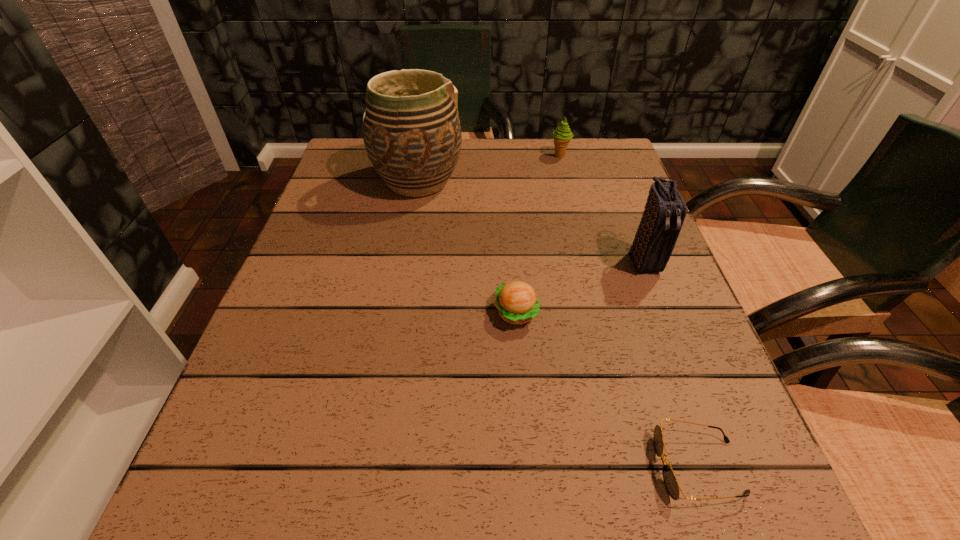
Locate an element on the screen. The image size is (960, 540). clutch bag that is at the right edge is located at coordinates (665, 210).

Identify the location of icecream at the right edge. The image size is (960, 540). (562, 135).

Locate an element on the screen. sunglasses located at the right edge is located at coordinates (670, 481).

Find the location of `object present at the far left corner`. object present at the far left corner is located at coordinates (411, 129).

Identify the location of object that is at the far right corner. The height and width of the screenshot is (540, 960). (562, 135).

This screenshot has width=960, height=540. Identify the location of object located at the near right corner. pyautogui.click(x=670, y=481).

At what (x,y) coordinates should I click in order to perform the action: click on free location at the far edge of the desktop. Please return your answer as a coordinate pair (x, y). Looking at the image, I should click on (487, 146).

Locate an element on the screen. Image resolution: width=960 pixels, height=540 pixels. free space at the left edge of the desktop is located at coordinates (318, 424).

Where is `vacant space at the right edge of the desktop`? The height and width of the screenshot is (540, 960). vacant space at the right edge of the desktop is located at coordinates (652, 351).

Locate an element on the screen. free space at the far right corner of the desktop is located at coordinates (566, 163).